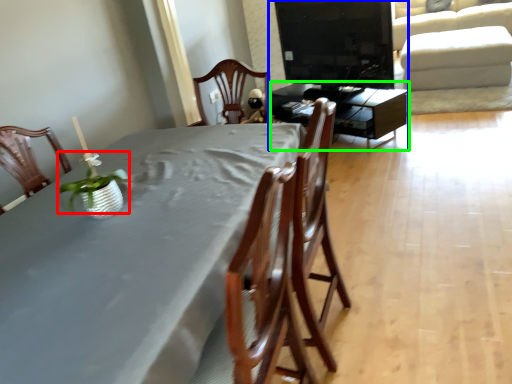
Question: Considering the real-world distances, which object is closest to plant (highlighted by a red box)? entertainment center (highlighted by a blue box) or table (highlighted by a green box).

Choices:
 (A) entertainment center
 (B) table

Answer: (B)